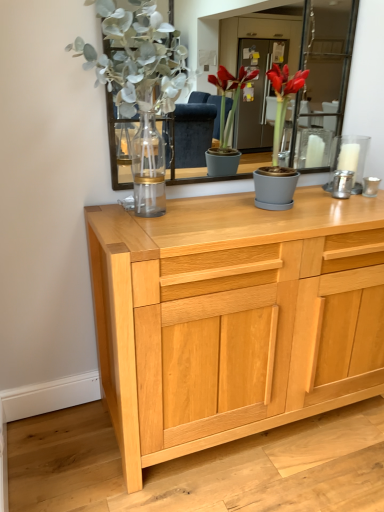
This screenshot has width=384, height=512. In order to click on empty space that is ontop of light wood cabinet at center (from a real-world perspective) in this screenshot , I will do `click(252, 212)`.